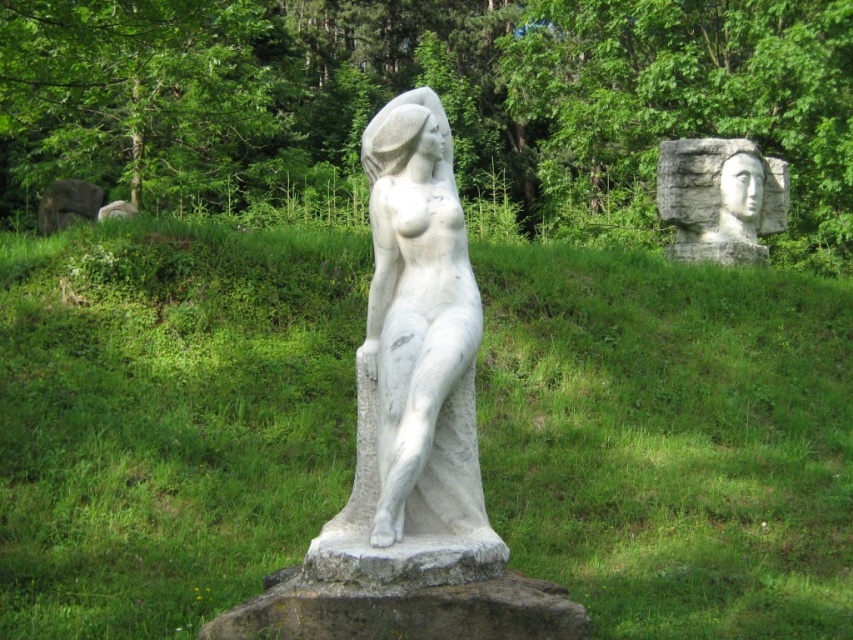
Question: Which of the following is the farthest from the observer?

Choices:
 (A) (64, 556)
 (B) (432, 342)

Answer: (A)

Question: Is the position of white marble statue at center more distant than that of white stone head at upper right?

Choices:
 (A) no
 (B) yes

Answer: (A)

Question: Does green grass at center appear on the left side of white marble statue at center?

Choices:
 (A) yes
 (B) no

Answer: (B)

Question: Does green grass at center have a larger size compared to white marble statue at center?

Choices:
 (A) yes
 (B) no

Answer: (A)

Question: Which of the following is the farthest from the observer?

Choices:
 (A) (422, 93)
 (B) (305, 433)
 (C) (689, 227)

Answer: (C)

Question: Which point is closer to the camera?

Choices:
 (A) white marble statue at center
 (B) green grass at center
 (C) white stone head at upper right

Answer: (A)